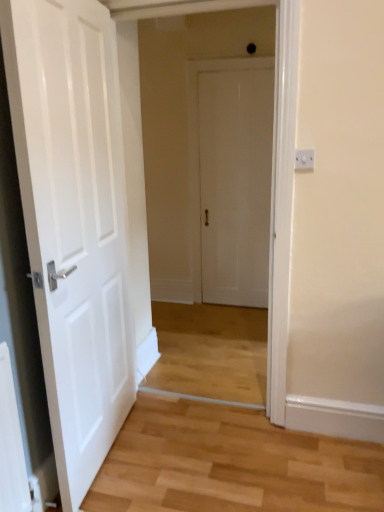
Measure the distance between white matte door at center, the second door in the front-to-back sequence, and camera.

3.20 meters.

The image size is (384, 512). Describe the element at coordinates (74, 222) in the screenshot. I see `white matte door at center, placed as the 2th door when sorted from right to left` at that location.

Describe the element at coordinates (304, 159) in the screenshot. I see `white plastic switch at upper right` at that location.

Where is `white matte door at center, the 1th door positioned from the back`? This screenshot has width=384, height=512. white matte door at center, the 1th door positioned from the back is located at coordinates (235, 184).

From the image's perspective, between white matte door at center, which ranks as the 1th door in right-to-left order, and white plastic switch at upper right, which one is located above?

white matte door at center, which ranks as the 1th door in right-to-left order, appears higher in the image.

Is white matte door at center, which ranks as the 1th door in right-to-left order, in front of or behind white plastic switch at upper right in the image?

Clearly, white matte door at center, which ranks as the 1th door in right-to-left order, is behind white plastic switch at upper right.

Is white matte door at center, the second door in the front-to-back sequence, not inside white plastic switch at upper right?

Yes.

I want to click on door above the white plastic switch at upper right (from the image's perspective), so click(235, 184).

From the image's perspective, is white plastic switch at upper right under white matte door at center, which ranks as the 1th door in right-to-left order?

Yes, from the image's perspective, white plastic switch at upper right is beneath white matte door at center, which ranks as the 1th door in right-to-left order.

Choose the correct answer: Is white plastic switch at upper right inside white matte door at center, the second door in the front-to-back sequence, or outside it?

white plastic switch at upper right is not inside white matte door at center, the second door in the front-to-back sequence, it's outside.

How many degrees apart are the facing directions of white plastic switch at upper right and white matte door at center, the 1th door positioned from the back?

The angular difference between white plastic switch at upper right and white matte door at center, the 1th door positioned from the back, is 0.00119 degrees.

Considering the sizes of objects white plastic switch at upper right and white matte door at center, which ranks as the 1th door in right-to-left order, in the image provided, who is smaller, white plastic switch at upper right or white matte door at center, which ranks as the 1th door in right-to-left order,?

Smaller between the two is white plastic switch at upper right.

Is white matte door at center, which is the 1th door in left-to-right order, at the right side of white plastic switch at upper right?

No, white matte door at center, which is the 1th door in left-to-right order, is not to the right of white plastic switch at upper right.

Which is correct: white matte door at center, the first door when ordered from front to back, is inside white plastic switch at upper right, or outside of it?

The correct answer is: outside.

From the image's perspective, which is below, white matte door at center, placed as the second door when sorted from back to front, or white plastic switch at upper right?

white matte door at center, placed as the second door when sorted from back to front, from the image's perspective.

How much distance is there between white matte door at center, the first door when ordered from front to back, and white plastic switch at upper right?

white matte door at center, the first door when ordered from front to back, and white plastic switch at upper right are 1.12 meters apart.

From a real-world perspective, is white plastic switch at upper right physically below white matte door at center, placed as the second door when sorted from back to front?

No, from a real-world perspective, white plastic switch at upper right is not under white matte door at center, placed as the second door when sorted from back to front.

Locate an element on the screen. The image size is (384, 512). door lying below the white plastic switch at upper right (from the image's perspective) is located at coordinates (74, 222).

From the image's perspective, which is below, white plastic switch at upper right or white matte door at center, placed as the second door when sorted from back to front?

white matte door at center, placed as the second door when sorted from back to front.

Based on the photo, how different are the orientations of white plastic switch at upper right and white matte door at center, placed as the second door when sorted from back to front, in degrees?

The facing directions of white plastic switch at upper right and white matte door at center, placed as the second door when sorted from back to front, are 95.4 degrees apart.

Which of these two, white matte door at center, placed as the second door when sorted from back to front, or white matte door at center, the second door in the front-to-back sequence, is smaller?

With smaller size is white matte door at center, the second door in the front-to-back sequence.

Where is `door that appears in front of the white matte door at center, the 1th door positioned from the back`? This screenshot has width=384, height=512. door that appears in front of the white matte door at center, the 1th door positioned from the back is located at coordinates (74, 222).

Is white matte door at center, the first door when ordered from front to back, completely or partially outside of white matte door at center, which ranks as the 1th door in right-to-left order?

Yes, white matte door at center, the first door when ordered from front to back, is outside of white matte door at center, which ranks as the 1th door in right-to-left order.

Between white matte door at center, which is the 1th door in left-to-right order, and white matte door at center, which ranks as the 1th door in right-to-left order, which one appears on the right side from the viewer's perspective?

white matte door at center, which ranks as the 1th door in right-to-left order, is more to the right.

Is white matte door at center, the second door in the front-to-back sequence, shorter than white matte door at center, placed as the 2th door when sorted from right to left?

Indeed, white matte door at center, the second door in the front-to-back sequence, has a lesser height compared to white matte door at center, placed as the 2th door when sorted from right to left.

Which is in front, white matte door at center, which ranks as the 1th door in right-to-left order, or white matte door at center, the first door when ordered from front to back?

white matte door at center, the first door when ordered from front to back, is in front.

From the image's perspective, is white matte door at center, the 1th door positioned from the back, beneath white matte door at center, placed as the second door when sorted from back to front?

No, from the image's perspective, white matte door at center, the 1th door positioned from the back, is not beneath white matte door at center, placed as the second door when sorted from back to front.

Is white matte door at center, the second door in the front-to-back sequence, looking in the opposite direction of white matte door at center, the first door when ordered from front to back?

No, white matte door at center, the second door in the front-to-back sequence, is not facing the opposite direction of white matte door at center, the first door when ordered from front to back.

There is a white plastic switch at upper right. Where is `the 2nd door below it (from a real-world perspective)`? The width and height of the screenshot is (384, 512). the 2nd door below it (from a real-world perspective) is located at coordinates (235, 184).

Identify the location of the 1st door to the left of the white plastic switch at upper right, starting your count from the anchor. tap(235, 184).

Which object lies nearer to the anchor point white matte door at center, the 1th door positioned from the back, white plastic switch at upper right or white matte door at center, placed as the second door when sorted from back to front?

Based on the image, white matte door at center, placed as the second door when sorted from back to front, appears to be nearer to white matte door at center, the 1th door positioned from the back.

Based on their spatial positions, is white matte door at center, which ranks as the 1th door in right-to-left order, or white plastic switch at upper right closer to white matte door at center, placed as the second door when sorted from back to front?

The object closer to white matte door at center, placed as the second door when sorted from back to front, is white plastic switch at upper right.

Estimate the real-world distances between objects in this image. Which object is further from white matte door at center, the first door when ordered from front to back, white plastic switch at upper right or white matte door at center, which is the 2th door in left-to-right order?

white matte door at center, which is the 2th door in left-to-right order, lies further to white matte door at center, the first door when ordered from front to back, than the other object.

Estimate the real-world distances between objects in this image. Which object is closer to white plastic switch at upper right, white matte door at center, the first door when ordered from front to back, or white matte door at center, which is the 2th door in left-to-right order?

Based on the image, white matte door at center, the first door when ordered from front to back, appears to be nearer to white plastic switch at upper right.

Looking at the image, which one is located closer to white matte door at center, which is the 2th door in left-to-right order, white matte door at center, placed as the second door when sorted from back to front, or white plastic switch at upper right?

white matte door at center, placed as the second door when sorted from back to front, lies closer to white matte door at center, which is the 2th door in left-to-right order, than the other object.

Considering their positions, is white matte door at center, which ranks as the 1th door in right-to-left order, positioned further to white plastic switch at upper right than white matte door at center, the first door when ordered from front to back?

Based on the image, white matte door at center, which ranks as the 1th door in right-to-left order, appears to be further to white plastic switch at upper right.

Locate an element on the screen. The width and height of the screenshot is (384, 512). electric outlet between white matte door at center, placed as the second door when sorted from back to front, and white matte door at center, which is the 2th door in left-to-right order, along the z-axis is located at coordinates (304, 159).